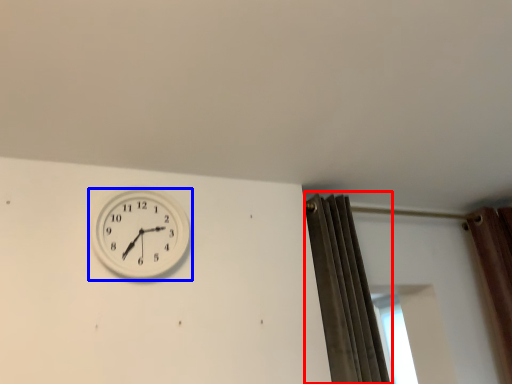
Question: Which point is closer to the camera, curtain (highlighted by a red box) or wall clock (highlighted by a blue box)?

Choices:
 (A) curtain
 (B) wall clock

Answer: (B)